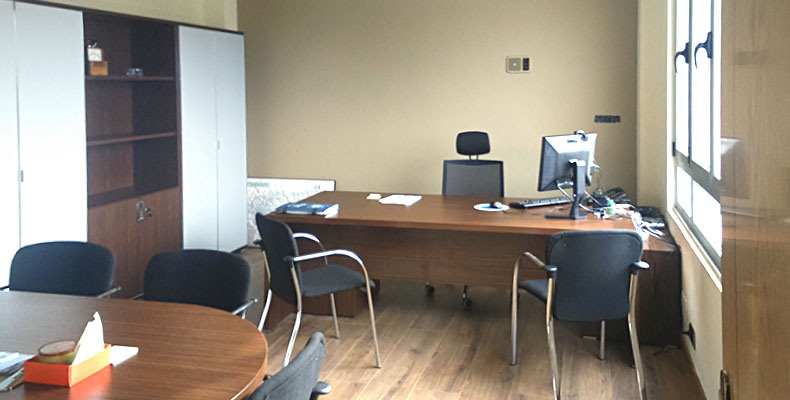
Identify the location of stack of papers. (401, 199).